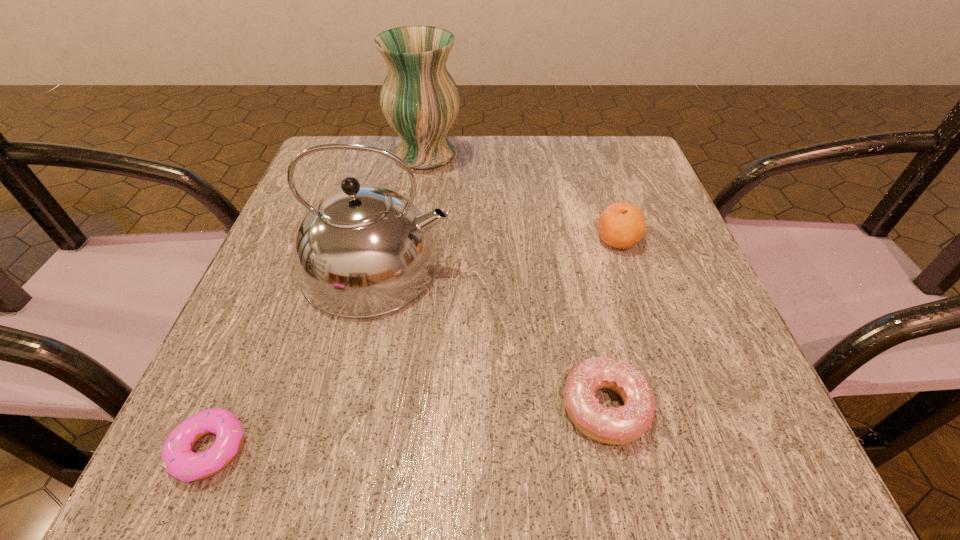
Find the location of a particular element. Image resolution: width=960 pixels, height=540 pixels. free space between the kettle and the clementine is located at coordinates (497, 253).

Find the location of a particular element. This screenshot has width=960, height=540. free point between the third shortest object and the shortest object is located at coordinates coord(414,344).

Identify the location of free space between the vase and the clementine. The width and height of the screenshot is (960, 540). (521, 197).

Where is `free space between the right doughnut and the kettle`? Image resolution: width=960 pixels, height=540 pixels. free space between the right doughnut and the kettle is located at coordinates (492, 336).

Image resolution: width=960 pixels, height=540 pixels. Identify the location of blank region between the third tallest object and the farthest object. [x=521, y=197].

This screenshot has height=540, width=960. I want to click on vacant area that lies between the third tallest object and the right doughnut, so click(x=612, y=323).

Where is `object that is the fourth closest to the fourth tallest object`? The width and height of the screenshot is (960, 540). object that is the fourth closest to the fourth tallest object is located at coordinates (420, 100).

Where is `the closest object to the second shortest object`? The width and height of the screenshot is (960, 540). the closest object to the second shortest object is located at coordinates (361, 251).

Where is `blank area in the image that satisfies the following two spatial constraints: 1. from the spout of the kettle; 2. on the right side of the fourth tallest object`? The image size is (960, 540). blank area in the image that satisfies the following two spatial constraints: 1. from the spout of the kettle; 2. on the right side of the fourth tallest object is located at coordinates (345, 407).

At what (x,y) coordinates should I click in order to perform the action: click on vacant point that satisfies the following two spatial constraints: 1. on the front side of the clementine; 2. from the spout of the kettle. Please return your answer as a coordinate pair (x, y). Looking at the image, I should click on click(626, 266).